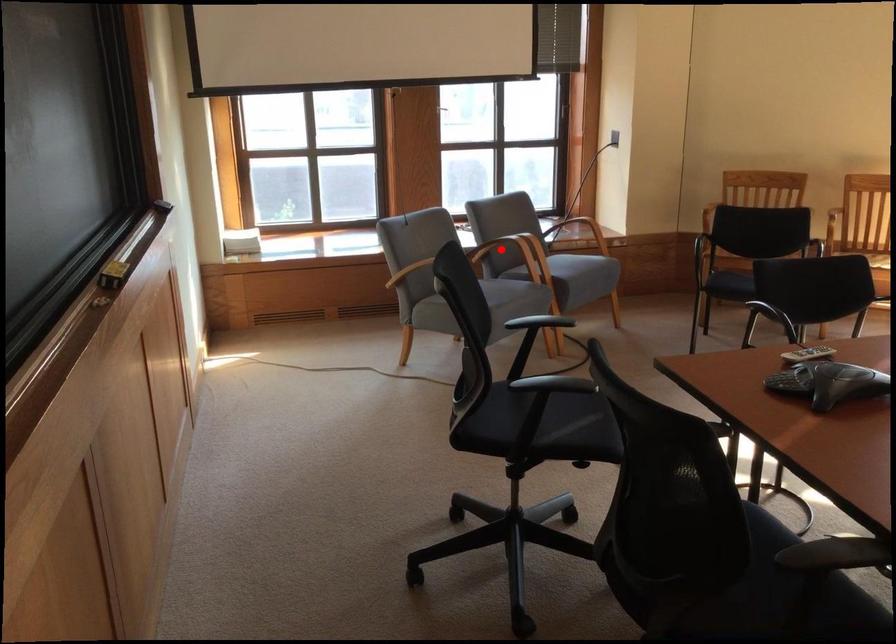
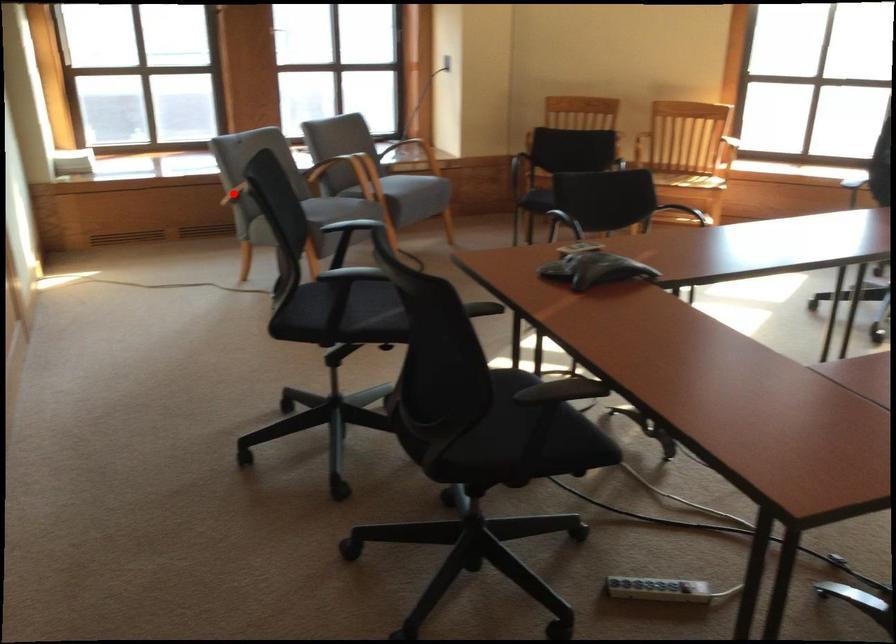
I am providing you with two images of the same scene from different viewpoints. A red point is marked on the first image and another point is marked on the second image. Do the highlighted points in image1 and image2 indicate the same real-world spot?

No